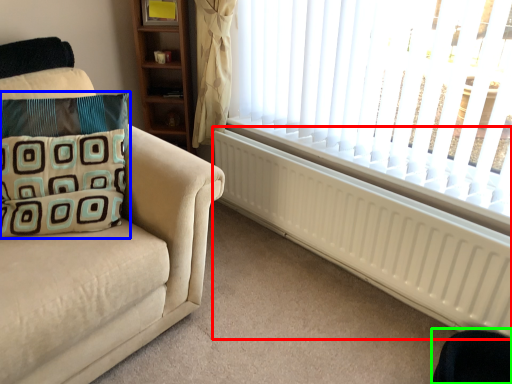
Question: Which object is positioned farthest from radiator (highlighted by a red box)? Select from pillow (highlighted by a blue box) and swivel chair (highlighted by a green box).

Choices:
 (A) pillow
 (B) swivel chair

Answer: (A)